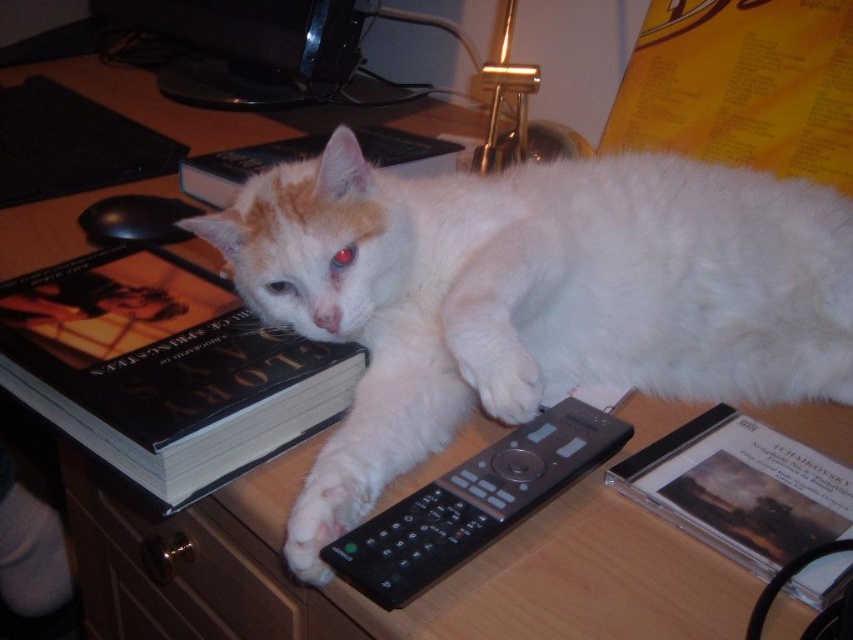
You are organizing the desk and need to move the black hardcover book at upper left. Where is the matte plastic cd case at lower right located in relation to the book?

The matte plastic cd case at lower right is behind the black hardcover book at upper left.

You are trying to reach the point at coordinates (141, 326) on the desk. If your hand is 12 inches long, can you comfortably reach that point?

The point at coordinates (141, 326) is 26.23 inches away from the viewer. Since your hand is only 12 inches long, you cannot comfortably reach that point.